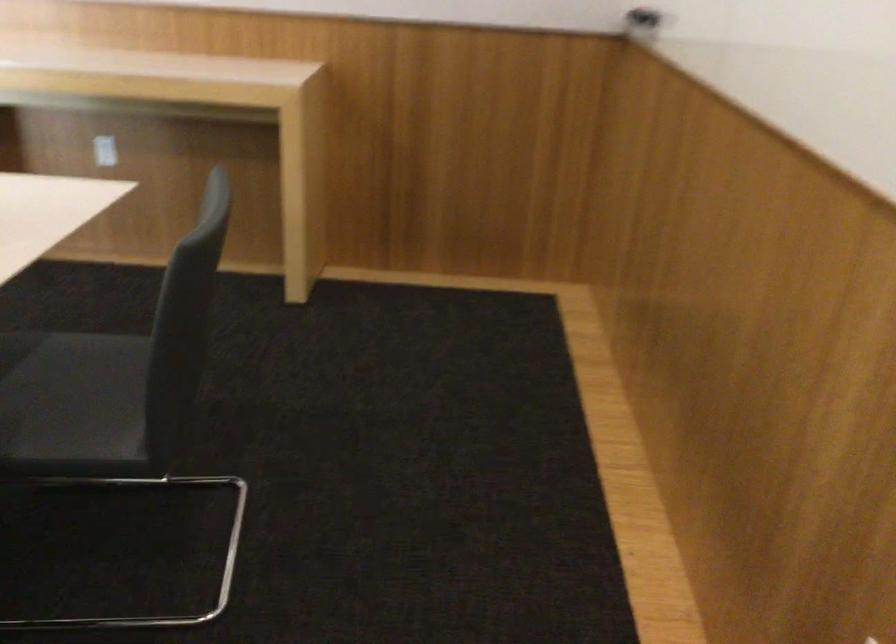
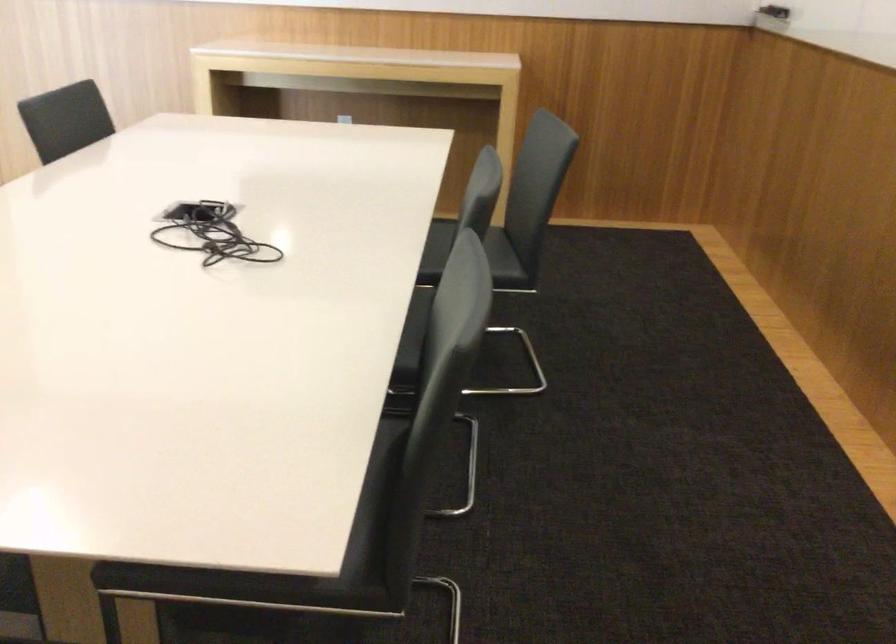
What movement of the cameraman would produce the second image?

The movement direction of the cameraman is left, backward.